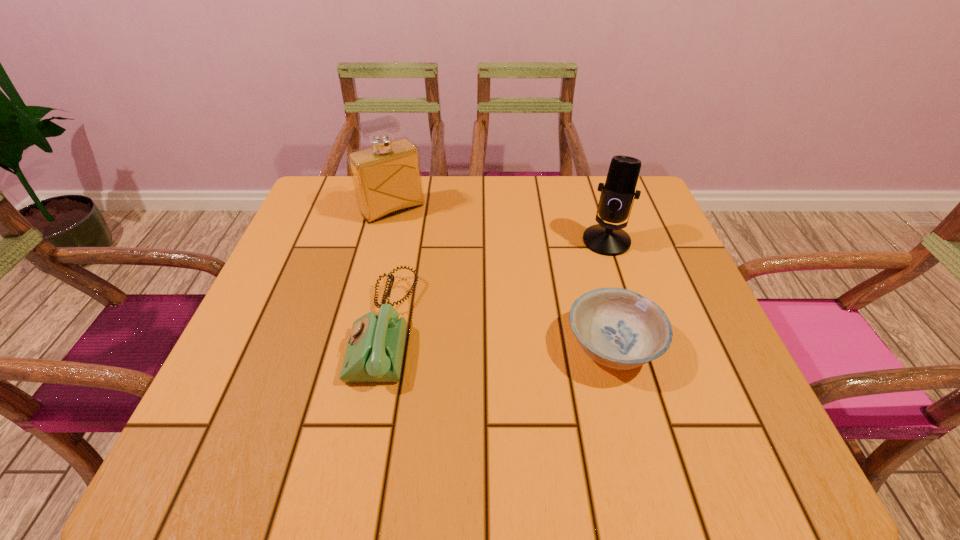
Identify the location of telephone. (374, 353).

You are a GUI agent. You are given a task and a screenshot of the screen. Output one action in this format:
    pyautogui.click(x=<x>, y=<y>)
    Task: Click on the bowl
    
    Given the screenshot: What is the action you would take?
    pyautogui.click(x=618, y=328)

Locate an element on the screen. The image size is (960, 540). the farthest object is located at coordinates (387, 178).

Identify the location of the third nearest object. (616, 198).

This screenshot has width=960, height=540. I want to click on vacant position located on the dial of the telephone, so click(296, 327).

Identify the location of vacant area located on the back of the bowl. (590, 265).

Locate an element on the screen. free space located on the front-facing side of the perfume is located at coordinates (419, 238).

The width and height of the screenshot is (960, 540). Identify the location of vacant space situated on the front-facing side of the perfume. (468, 296).

This screenshot has height=540, width=960. Find the location of `vacant region located 0.130m on the front-facing side of the perfume`. vacant region located 0.130m on the front-facing side of the perfume is located at coordinates (430, 251).

Identify the location of vacant space located 0.260m on the stand of the third nearest object. (542, 324).